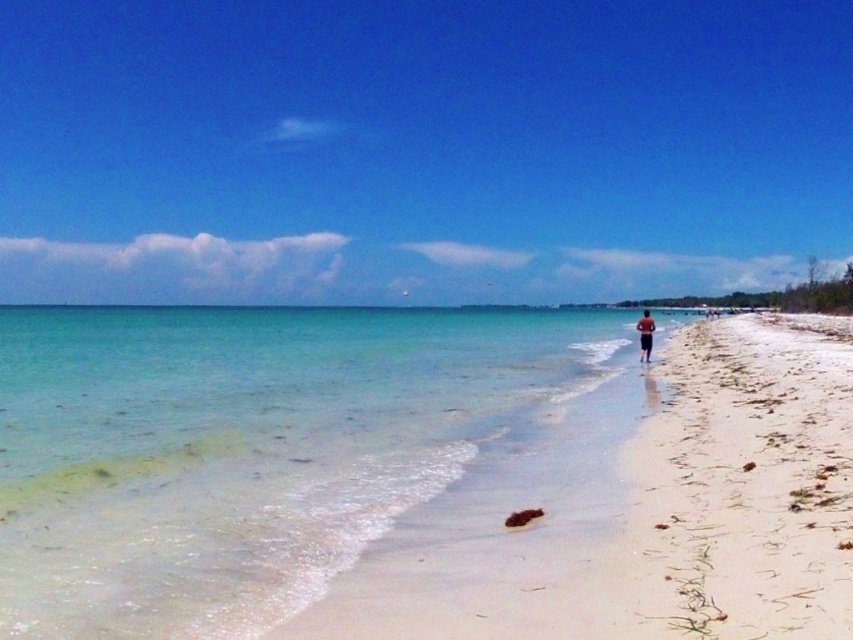
Can you confirm if white sandy beach at right is positioned to the left of brown textured shorts at center-right?

No, white sandy beach at right is not to the left of brown textured shorts at center-right.

Where is `white sandy beach at right`? white sandy beach at right is located at coordinates (741, 490).

Between white sandy beach at center and brown textured shorts at center-right, which one appears on the left side from the viewer's perspective?

brown textured shorts at center-right is more to the left.

Does white sandy beach at center have a larger size compared to brown textured shorts at center-right?

Yes.

Is point (821, 490) closer to camera compared to point (640, 332)?

That is True.

The image size is (853, 640). In order to click on white sandy beach at center in this screenshot , I will do `click(654, 515)`.

Is white sandy beach at center positioned before white sandy beach at right?

No, it is behind white sandy beach at right.

Does white sandy beach at center have a greater height compared to white sandy beach at right?

Indeed, white sandy beach at center has a greater height compared to white sandy beach at right.

Locate an element on the screen. The height and width of the screenshot is (640, 853). white sandy beach at center is located at coordinates (654, 515).